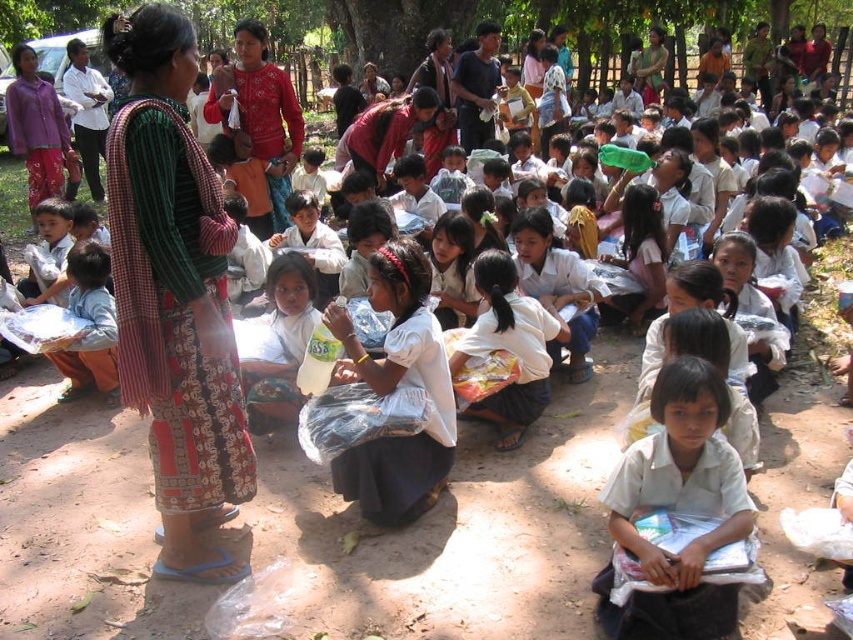
Does white cotton shirt at lower right have a lesser width compared to red woven fabric at center?

Yes.

Describe the element at coordinates (677, 509) in the screenshot. I see `white cotton shirt at lower right` at that location.

In order to click on white cotton shirt at lower right in this screenshot , I will do `click(677, 509)`.

This screenshot has width=853, height=640. Identify the location of white cotton shirt at lower right. (677, 509).

Which is above, green leafy tree at upper center or red woven fabric at center?

Positioned higher is green leafy tree at upper center.

In the scene shown: Between green leafy tree at upper center and red woven fabric at center, which one has more height?

green leafy tree at upper center is taller.

Between point (224, 4) and point (225, 84), which one is positioned in front?

Point (225, 84) is more forward.

Image resolution: width=853 pixels, height=640 pixels. I want to click on green leafy tree at upper center, so click(x=497, y=19).

How much distance is there between printed cotton dress at left and white cotton shirt at lower right?

printed cotton dress at left and white cotton shirt at lower right are 1.73 meters apart from each other.

Who is positioned more to the left, printed cotton dress at left or white cotton shirt at lower right?

printed cotton dress at left

This screenshot has width=853, height=640. Describe the element at coordinates (173, 294) in the screenshot. I see `printed cotton dress at left` at that location.

You are a GUI agent. You are given a task and a screenshot of the screen. Output one action in this format:
    pyautogui.click(x=<x>, y=<y>)
    Task: Click on the printed cotton dress at left
    This screenshot has width=853, height=640.
    Given the screenshot: What is the action you would take?
    pyautogui.click(x=173, y=294)